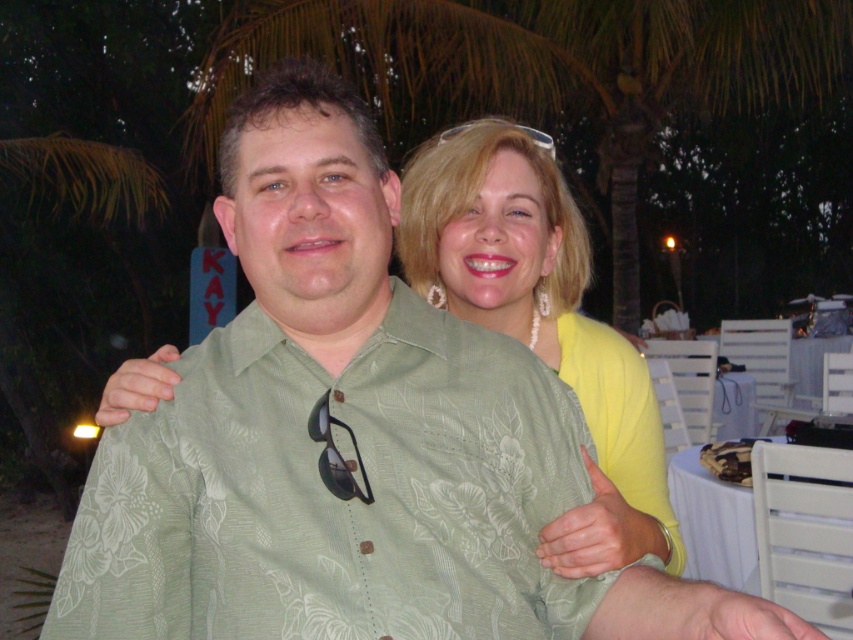
Question: Can you confirm if green floral-patterned shirt at center is positioned above green leafy palm tree at upper center?

Choices:
 (A) yes
 (B) no

Answer: (B)

Question: Based on their relative distances, which object is nearer to the green floral-patterned shirt at center?

Choices:
 (A) green leafy palm tree at upper center
 (B) pearl necklace at upper center

Answer: (B)

Question: Is green leafy palm tree at upper center positioned before pearl necklace at upper center?

Choices:
 (A) no
 (B) yes

Answer: (A)

Question: Does green leafy palm tree at upper center appear on the left side of pearl necklace at upper center?

Choices:
 (A) yes
 (B) no

Answer: (B)

Question: Among these objects, which one is nearest to the camera?

Choices:
 (A) green floral-patterned shirt at center
 (B) green leafy palm tree at upper center
 (C) pearl necklace at upper center

Answer: (A)

Question: Which object appears closest to the camera in this image?

Choices:
 (A) pearl necklace at upper center
 (B) green floral-patterned shirt at center

Answer: (B)